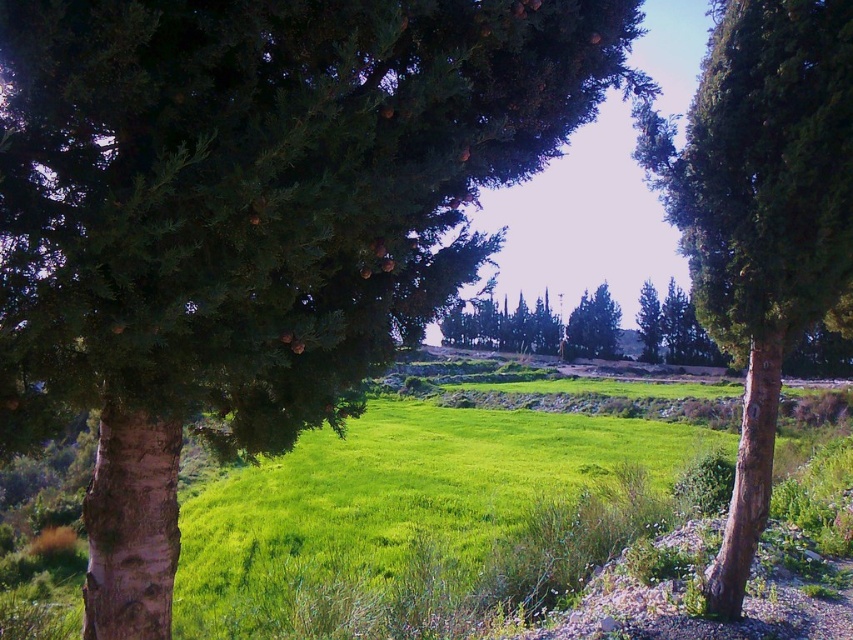
Question: Can you confirm if green rough bark tree at right is positioned below green leafy tree at center?

Choices:
 (A) no
 (B) yes

Answer: (A)

Question: Which point is farther to the camera?

Choices:
 (A) [x=656, y=310]
 (B) [x=646, y=163]

Answer: (A)

Question: Which point is closer to the camera?

Choices:
 (A) green leafy tree at center
 (B) green rough bark tree at right

Answer: (B)

Question: In this image, where is green rough bark tree at right located relative to green leafy tree at center?

Choices:
 (A) left
 (B) right

Answer: (A)

Question: Does green rough bark tree at right have a smaller size compared to green leafy tree at center?

Choices:
 (A) yes
 (B) no

Answer: (A)